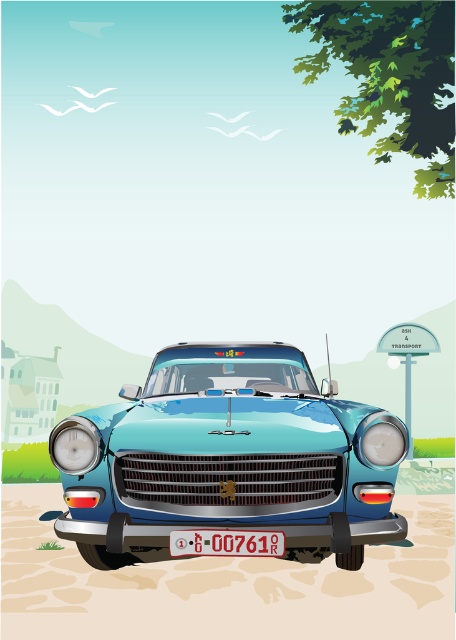
Question: Can you confirm if green leafy tree at upper right is positioned below white plastic license plate at center?

Choices:
 (A) yes
 (B) no

Answer: (B)

Question: Can you confirm if glossy metallic car at center is positioned to the left of white plastic license plate at center?

Choices:
 (A) yes
 (B) no

Answer: (B)

Question: Estimate the real-world distances between objects in this image. Which object is closer to the glossy metallic car at center?

Choices:
 (A) green leafy tree at upper right
 (B) white plastic license plate at center

Answer: (B)

Question: Which point is closer to the camera taking this photo?

Choices:
 (A) (227, 544)
 (B) (394, 76)

Answer: (A)

Question: Is green leafy tree at upper right below white plastic license plate at center?

Choices:
 (A) no
 (B) yes

Answer: (A)

Question: Which of the following is the farthest from the observer?

Choices:
 (A) white plastic license plate at center
 (B) green leafy tree at upper right

Answer: (B)